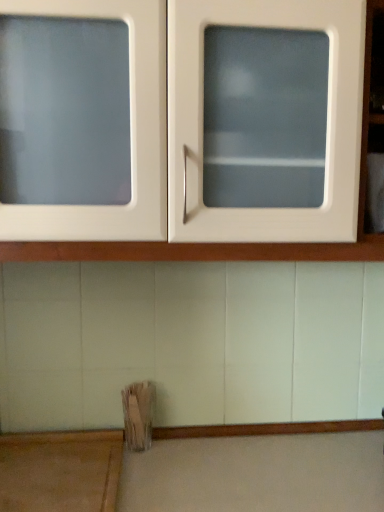
Identify the location of free space above wooden at lower left (from a real-world perspective). This screenshot has width=384, height=512. (50, 462).